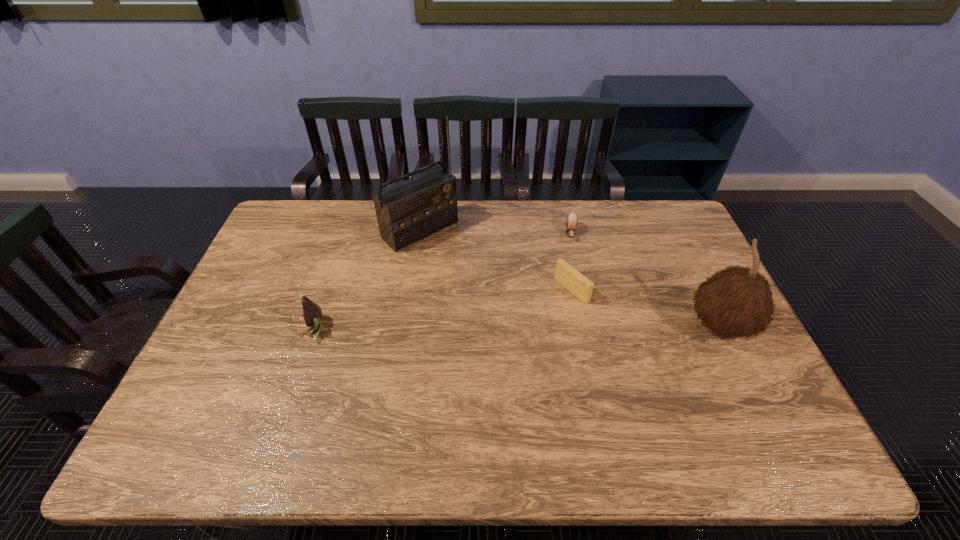
Where is `vacant point located between the videotape and the shortest object`? vacant point located between the videotape and the shortest object is located at coordinates (571, 261).

Locate an element on the screen. vacant space that's between the coconut and the leftmost object is located at coordinates (517, 328).

Locate an element on the screen. This screenshot has height=540, width=960. empty location between the tallest object and the videotape is located at coordinates (496, 260).

Image resolution: width=960 pixels, height=540 pixels. I want to click on free space between the videotape and the leftmost object, so click(x=443, y=309).

Identify the location of free space between the second object from left to right and the leftmost object. (368, 279).

Locate an element on the screen. This screenshot has height=540, width=960. unoccupied position between the videotape and the third shortest object is located at coordinates (443, 309).

Locate an element on the screen. vacant space that's between the radio receiver and the videotape is located at coordinates (496, 260).

Identify which object is located as the third nearest to the second tallest object. Please provide its 2D coordinates. Your answer should be formatted as a tuple, i.e. [(x, y)], where the tuple contains the x and y coordinates of a point satisfying the conditions above.

[(410, 210)]

Where is `object that is the closest to the escargot`? The width and height of the screenshot is (960, 540). object that is the closest to the escargot is located at coordinates (565, 274).

Find the location of a particular element. This screenshot has width=960, height=540. vacant space that satisfies the following two spatial constraints: 1. on the front side of the videotape; 2. on the left side of the second object from left to right is located at coordinates (411, 290).